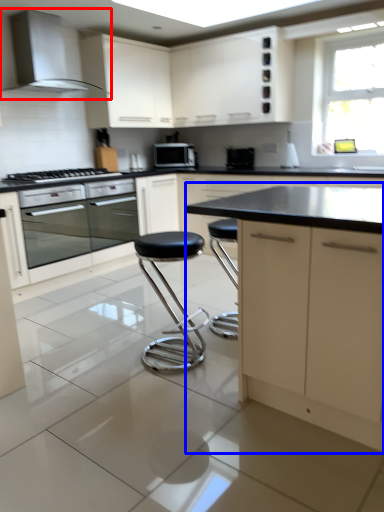
Question: Which of the following is the closest to the observer, home appliance (highlighted by a red box) or cabinetry (highlighted by a blue box)?

Choices:
 (A) home appliance
 (B) cabinetry

Answer: (B)